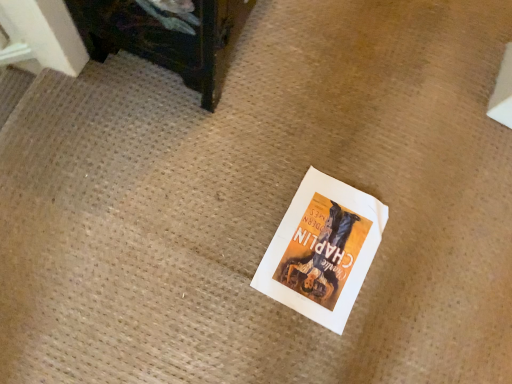
Locate an element on the screen. The height and width of the screenshot is (384, 512). free space above white paper at center (from a real-world perspective) is located at coordinates pos(324,248).